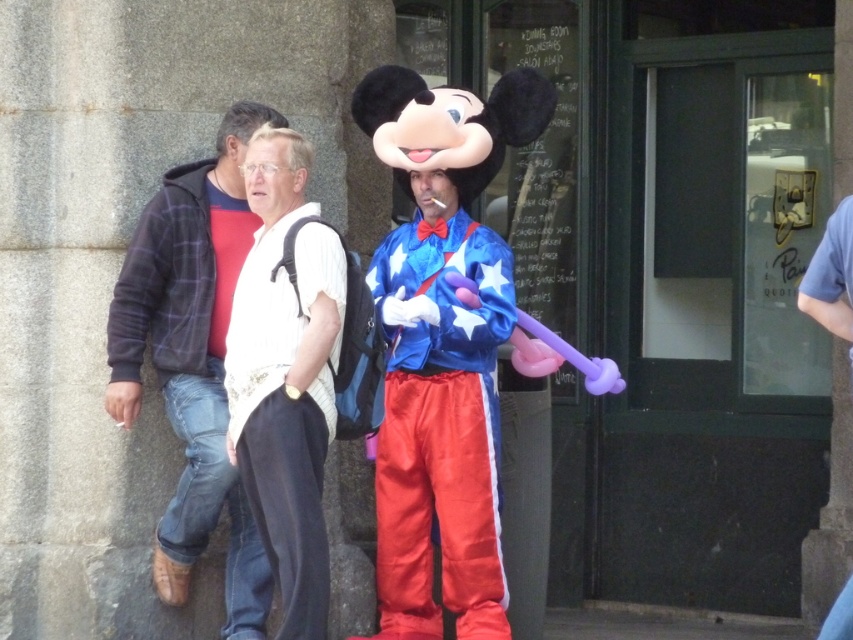
What do you see at coordinates (447, 388) in the screenshot? The width and height of the screenshot is (853, 640). I see `shiny blue fabric at center` at bounding box center [447, 388].

In the scene shown: Does shiny blue fabric at center have a larger size compared to velvet blue costume at center?

Indeed, shiny blue fabric at center has a larger size compared to velvet blue costume at center.

At what (x,y) coordinates should I click in order to perform the action: click on shiny blue fabric at center. Please return your answer as a coordinate pair (x, y). Image resolution: width=853 pixels, height=640 pixels. Looking at the image, I should click on (447, 388).

Is shiny blue fabric at center taller than white knit sweater at center?

Yes.

This screenshot has height=640, width=853. What are the coordinates of `shiny blue fabric at center` in the screenshot? It's located at point(447,388).

Can you confirm if white knit sweater at center is bigger than velvet blue costume at center?

Actually, white knit sweater at center might be smaller than velvet blue costume at center.

Does point (115, 342) lie in front of point (520, 122)?

That is True.

Find the location of a particular element. The image size is (853, 640). white knit sweater at center is located at coordinates (193, 360).